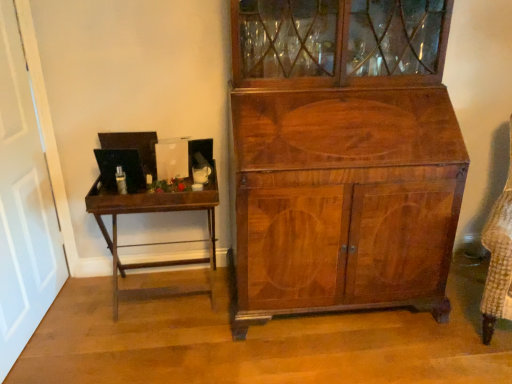
Identify the location of free point in front of wooden table at left. (153, 351).